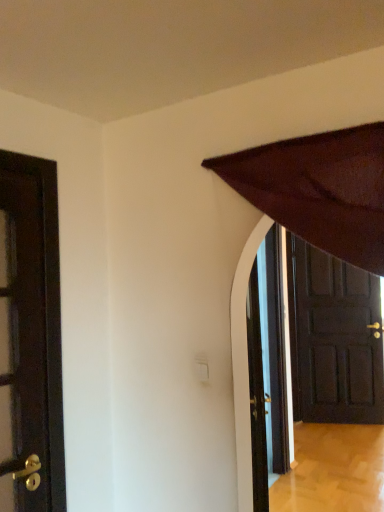
Question: From the image's perspective, relative to dark wood door at right, which is the 1th door from back to front, is dark brown wooden door at left, the first door viewed from the front, above or below?

Choices:
 (A) above
 (B) below

Answer: (A)

Question: From their relative heights in the image, would you say dark brown wooden door at left, the 2th door when ordered from right to left, is taller or shorter than dark wood door at right, which is the 1th door from back to front?

Choices:
 (A) tall
 (B) short

Answer: (B)

Question: Considering the positions of point (19, 312) and point (334, 389), is point (19, 312) closer or farther from the camera than point (334, 389)?

Choices:
 (A) farther
 (B) closer

Answer: (B)

Question: Considering the positions of point (327, 261) and point (8, 391), is point (327, 261) closer or farther from the camera than point (8, 391)?

Choices:
 (A) farther
 (B) closer

Answer: (A)

Question: Choose the correct answer: Is dark wood door at right, placed as the second door when sorted from left to right, inside dark brown wooden door at left, the 2th door when ordered from right to left, or outside it?

Choices:
 (A) outside
 (B) inside

Answer: (A)

Question: From the image's perspective, is dark wood door at right, which is the 1th door from back to front, above or below dark brown wooden door at left, the first door viewed from the front?

Choices:
 (A) below
 (B) above

Answer: (A)

Question: Relative to dark brown wooden door at left, the first door viewed from the front, is dark wood door at right, which is the 1th door from back to front, in front or behind?

Choices:
 (A) front
 (B) behind

Answer: (B)